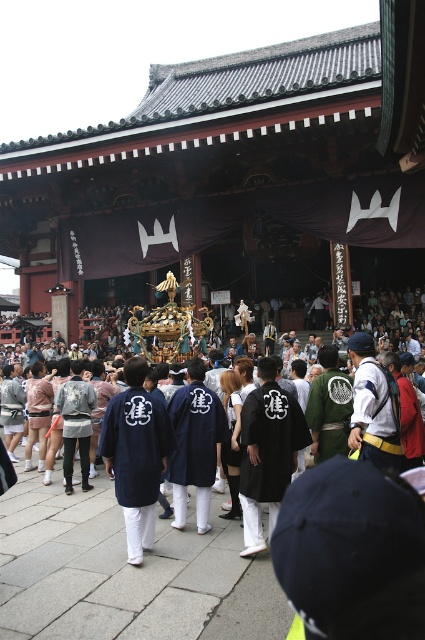
Question: Does navy blue fabric robe at center have a larger size compared to black matte robe at center?

Choices:
 (A) no
 (B) yes

Answer: (B)

Question: Where is navy blue fabric robe at center located in relation to black matte robe at center in the image?

Choices:
 (A) left
 (B) right

Answer: (A)

Question: Which point is closer to the camera taking this photo?

Choices:
 (A) (125, 512)
 (B) (255, 497)

Answer: (A)

Question: Does navy blue fabric robe at center appear under black matte robe at center?

Choices:
 (A) no
 (B) yes

Answer: (B)